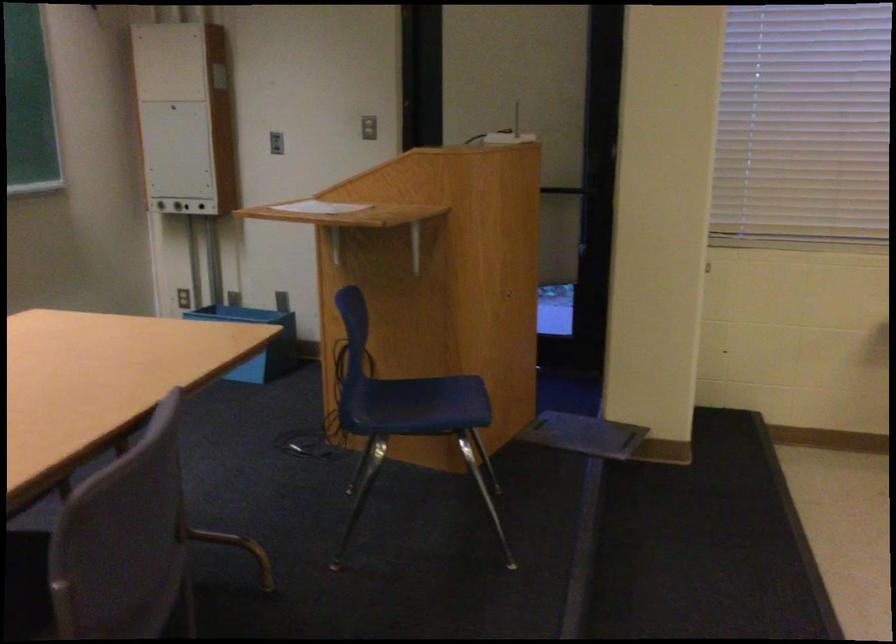
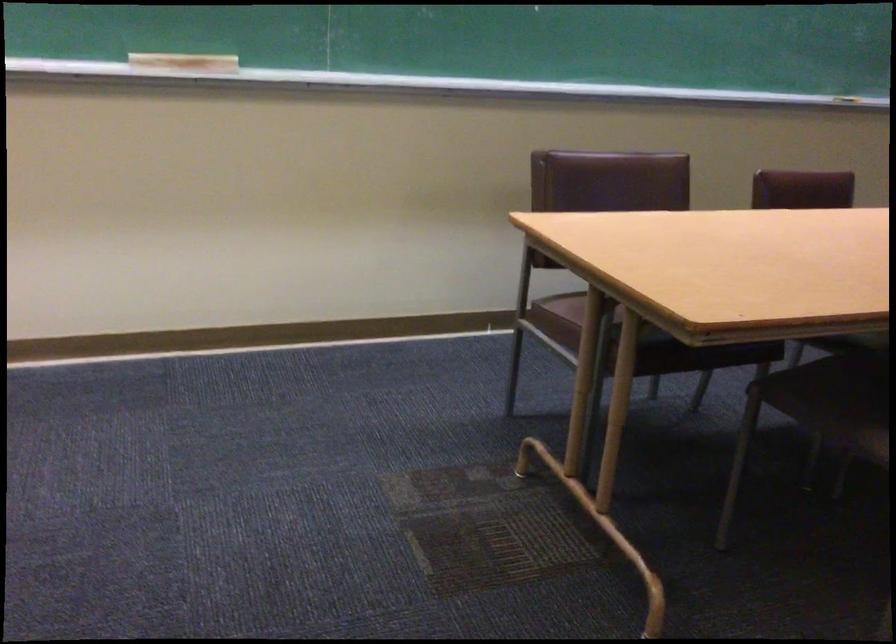
Question: How did the camera likely rotate?

Choices:
 (A) Left
 (B) Right
 (C) Up
 (D) Down

Answer: (A)